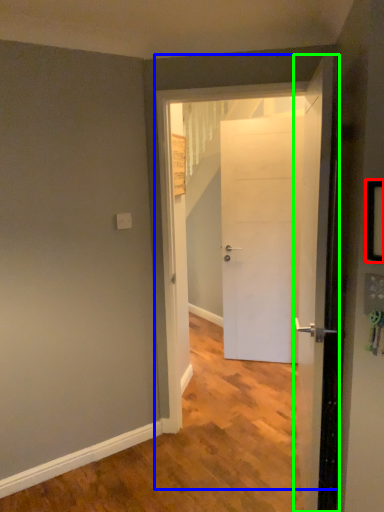
Question: Estimate the real-world distances between objects in this image. Which object is farther from picture frame (highlighted by a red box), door (highlighted by a blue box) or door (highlighted by a green box)?

Choices:
 (A) door
 (B) door

Answer: (A)